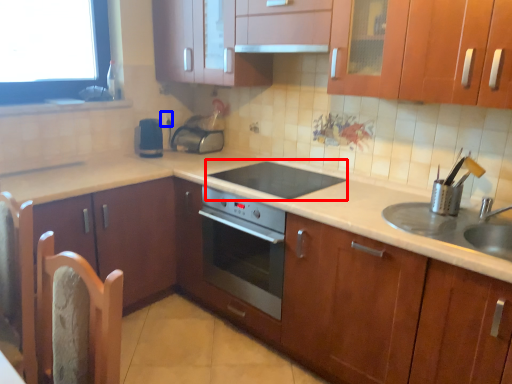
Question: Which point is further to the camera, gas stove (highlighted by a red box) or electric outlet (highlighted by a blue box)?

Choices:
 (A) gas stove
 (B) electric outlet

Answer: (B)